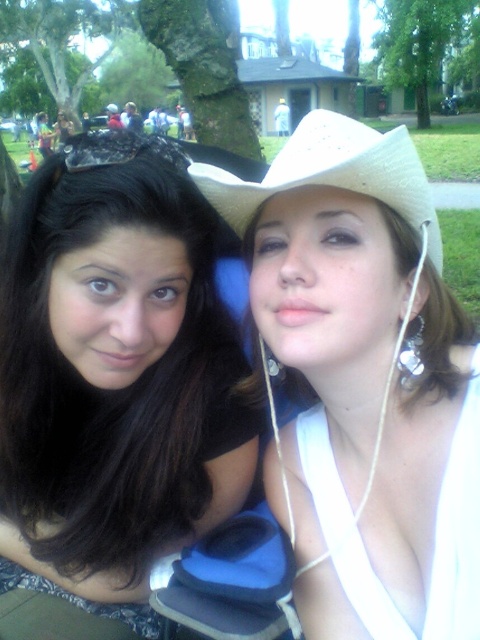
Does white matte cowboy hat at upper right appear under black matte hair at center?

Actually, white matte cowboy hat at upper right is above black matte hair at center.

Between point (330, 131) and point (84, 388), which one is positioned behind?

The point (84, 388) is behind.

Describe the element at coordinates (364, 381) in the screenshot. I see `white matte cowboy hat at upper right` at that location.

The image size is (480, 640). I want to click on white matte cowboy hat at upper right, so click(x=364, y=381).

Measure the distance from black matte hair at center to white straw cowboy hat at upper right.

black matte hair at center is 16.68 inches from white straw cowboy hat at upper right.

Which is in front, point (156, 429) or point (386, 145)?

Positioned in front is point (386, 145).

This screenshot has width=480, height=640. Find the location of `black matte hair at center`. black matte hair at center is located at coordinates (115, 376).

Can you confirm if white matte cowboy hat at upper right is positioned to the left of white straw cowboy hat at upper right?

Indeed, white matte cowboy hat at upper right is positioned on the left side of white straw cowboy hat at upper right.

Is point (285, 452) in front of point (418, 236)?

No, (285, 452) is further to viewer.

Locate an element on the screen. The image size is (480, 640). white matte cowboy hat at upper right is located at coordinates (364, 381).